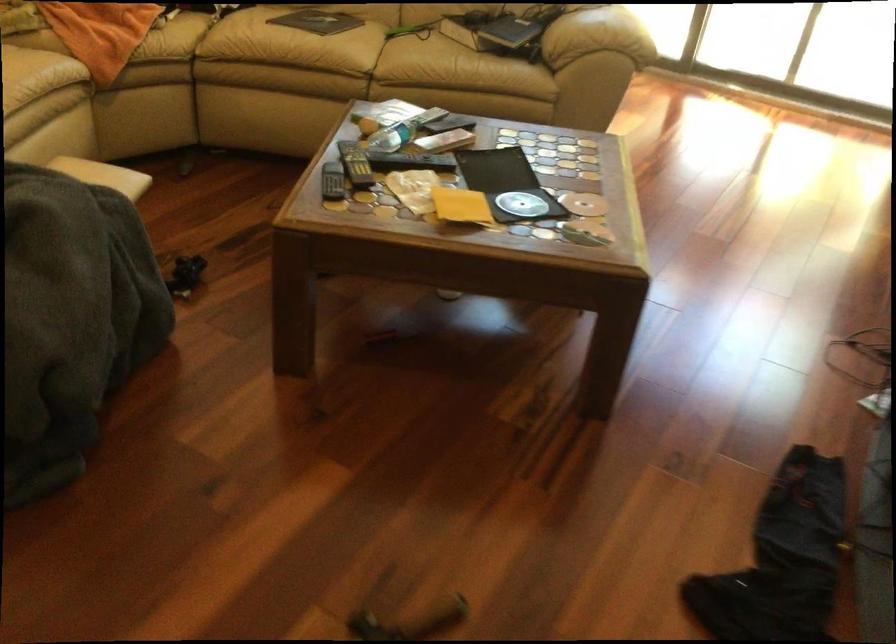
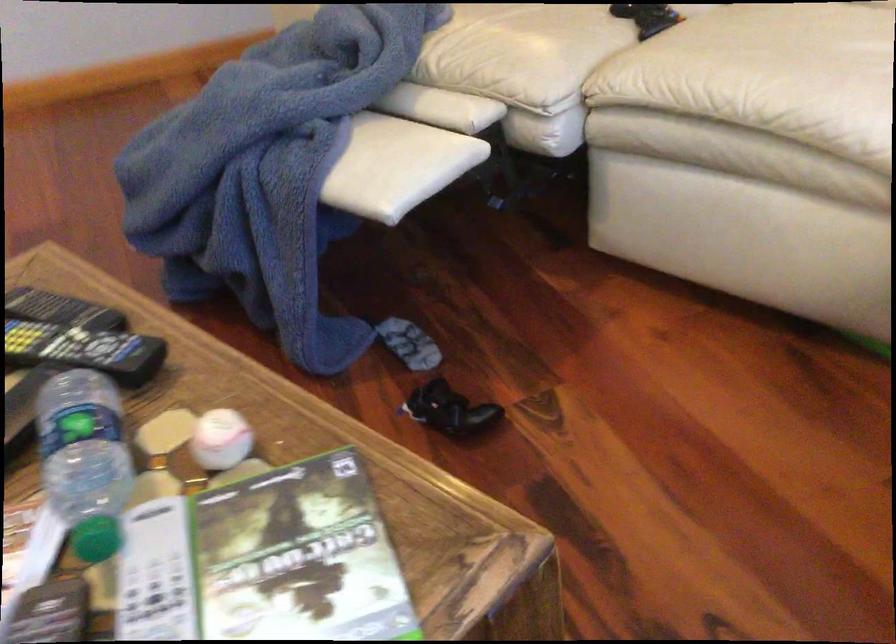
Find the pixel in the second image that matches (x=424, y=122) in the first image.

(156, 574)